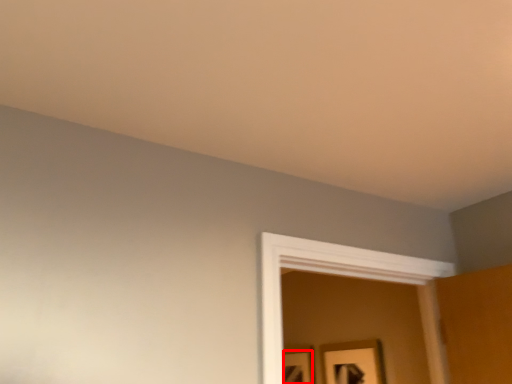
Question: From the image, what is the correct spatial relationship of picture frame (annotated by the red box) in relation to picture frame?

Choices:
 (A) right
 (B) left

Answer: (B)